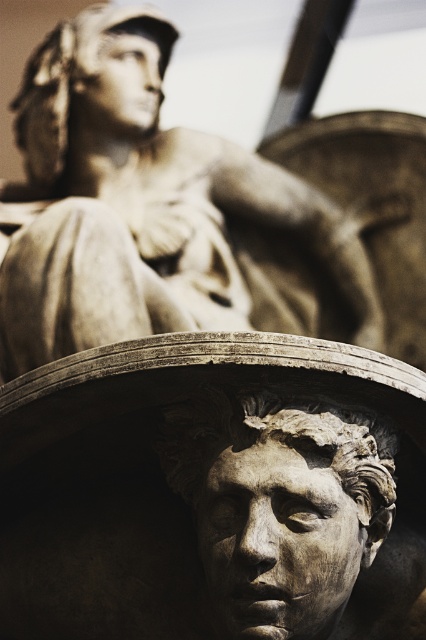
Question: Among these objects, which one is nearest to the camera?

Choices:
 (A) matte stone head at center
 (B) matte stone statue at upper left
 (C) matte bronze head at upper center

Answer: (A)

Question: Which object appears closest to the camera in this image?

Choices:
 (A) matte bronze head at upper center
 (B) matte stone statue at upper left
 (C) matte stone head at center

Answer: (C)

Question: Is the position of matte stone head at center less distant than that of matte bronze head at upper center?

Choices:
 (A) yes
 (B) no

Answer: (A)

Question: Is matte stone head at center positioned before matte bronze head at upper center?

Choices:
 (A) no
 (B) yes

Answer: (B)

Question: Among these points, which one is farthest from the camera?

Choices:
 (A) (393, 461)
 (B) (126, 259)

Answer: (B)

Question: Does matte stone statue at upper left appear on the right side of matte bronze head at upper center?

Choices:
 (A) no
 (B) yes

Answer: (B)